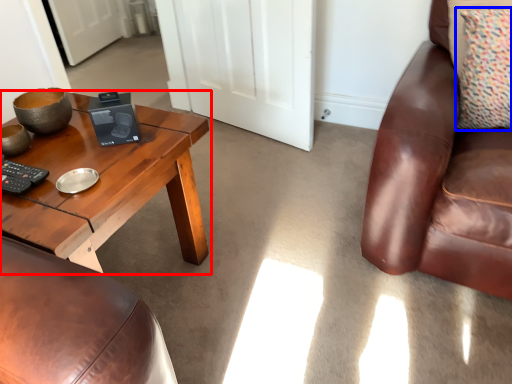
Question: Which object appears farthest to the camera in this image, coffee table (highlighted by a red box) or pillow (highlighted by a blue box)?

Choices:
 (A) coffee table
 (B) pillow

Answer: (B)